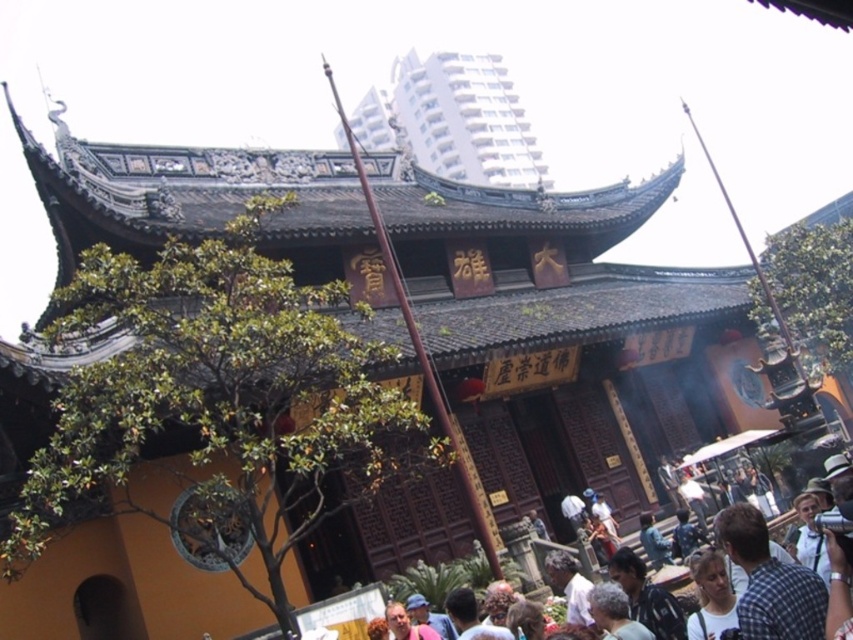
Question: Can you confirm if white glossy building at upper center is positioned to the right of light brown hair at lower right?

Choices:
 (A) yes
 (B) no

Answer: (B)

Question: Can you confirm if white glossy building at upper center is positioned to the right of light brown hair at lower right?

Choices:
 (A) yes
 (B) no

Answer: (B)

Question: Can you confirm if white glossy building at upper center is positioned to the right of light brown hair at lower right?

Choices:
 (A) no
 (B) yes

Answer: (A)

Question: Which object appears closest to the camera in this image?

Choices:
 (A) white glossy building at upper center
 (B) light brown hair at lower right

Answer: (B)

Question: Among these points, which one is farthest from the camera?

Choices:
 (A) (711, 634)
 (B) (451, 150)

Answer: (B)

Question: Which object is closer to the camera taking this photo?

Choices:
 (A) light brown hair at lower right
 (B) white glossy building at upper center

Answer: (A)